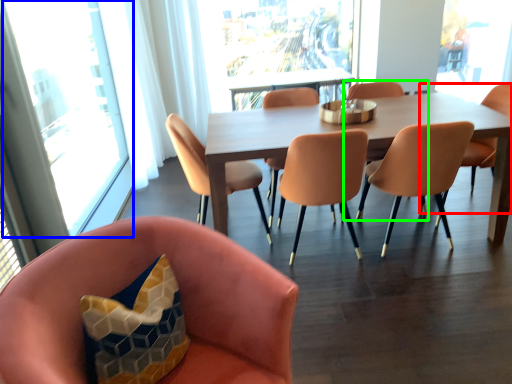
Question: Which is farther away from chair (highlighted by a red box)? window (highlighted by a blue box) or armchair (highlighted by a green box)?

Choices:
 (A) window
 (B) armchair

Answer: (A)